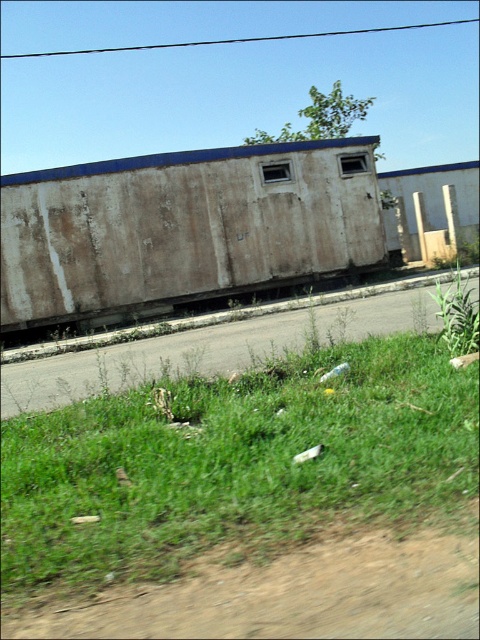
Question: Is the position of green grass at lower left less distant than that of green grass at lower right?

Choices:
 (A) no
 (B) yes

Answer: (B)

Question: Which of the following is the farthest from the observer?

Choices:
 (A) (368, 481)
 (B) (471, 321)

Answer: (B)

Question: Is green grass at lower left behind rusty metal train car at center?

Choices:
 (A) yes
 (B) no

Answer: (B)

Question: Can you confirm if green grass at lower left is positioned to the right of rusty metal train car at center?

Choices:
 (A) no
 (B) yes

Answer: (B)

Question: Which of the following is the closest to the observer?

Choices:
 (A) green grass at lower right
 (B) green grass at lower left

Answer: (B)

Question: Which of these objects is positioned closest to the green grass at lower right?

Choices:
 (A) rusty metal train car at center
 (B) green grass at lower left

Answer: (B)